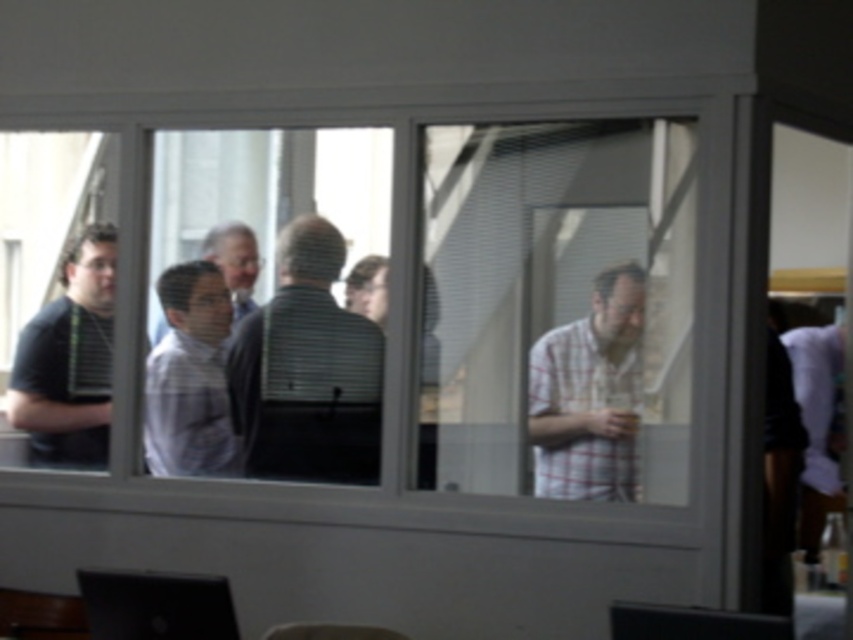
Question: Is the position of plaid fabric shirt at right more distant than that of matte white shirt at center?

Choices:
 (A) no
 (B) yes

Answer: (A)

Question: Is plaid fabric shirt at right to the left of black glossy monitor at lower center from the viewer's perspective?

Choices:
 (A) no
 (B) yes

Answer: (B)

Question: Estimate the real-world distances between objects in this image. Which object is farther from the matte black laptop at lower left?

Choices:
 (A) black matte shirt at left
 (B) plaid fabric shirt at right
 (C) striped shirt at center

Answer: (A)

Question: Among these objects, which one is farthest from the camera?

Choices:
 (A) transparent glass window at center
 (B) black matte shirt at left
 (C) striped shirt at center
 (D) black glossy monitor at lower center

Answer: (B)

Question: Estimate the real-world distances between objects in this image. Which object is farther from the matte black laptop at lower left?

Choices:
 (A) light gray shirt at center
 (B) plaid fabric shirt at right

Answer: (A)

Question: Can you confirm if matte white shirt at center is wider than matte black laptop at lower left?

Choices:
 (A) no
 (B) yes

Answer: (A)